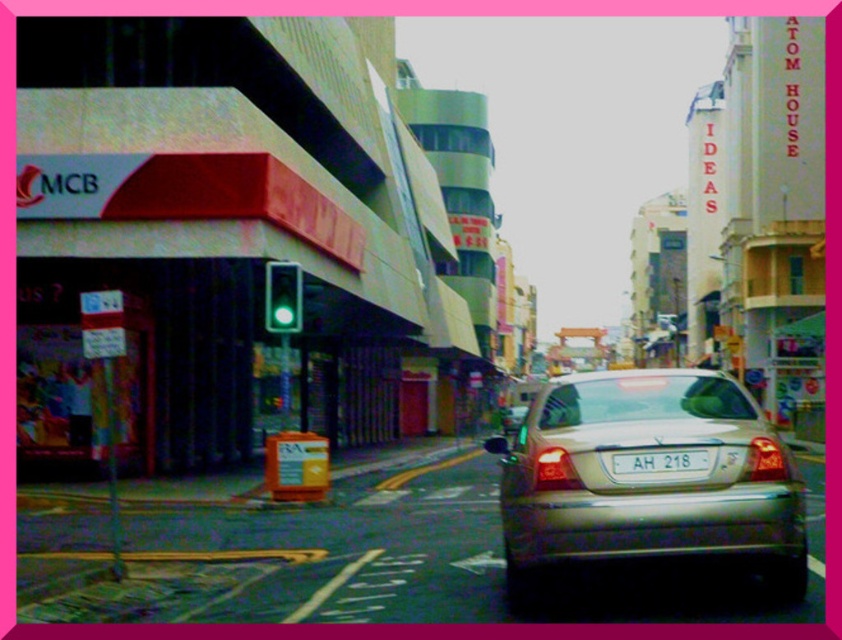
Can you confirm if silver metallic car at center is positioned above white plastic license plate at center?

No, silver metallic car at center is not above white plastic license plate at center.

Does silver metallic car at center come in front of white plastic license plate at center?

Yes.

Between point (734, 545) and point (656, 456), which one is positioned behind?

The point (734, 545) is behind.

The image size is (842, 640). What are the coordinates of `silver metallic car at center` in the screenshot? It's located at (647, 477).

Can you confirm if silver metallic car at center is positioned above green glass traffic light at center?

No, silver metallic car at center is not above green glass traffic light at center.

Can you confirm if silver metallic car at center is positioned to the right of green glass traffic light at center?

Yes, silver metallic car at center is to the right of green glass traffic light at center.

What do you see at coordinates (647, 477) in the screenshot? I see `silver metallic car at center` at bounding box center [647, 477].

Find the location of a particular element. This screenshot has width=842, height=640. silver metallic car at center is located at coordinates (647, 477).

Describe the element at coordinates (281, 298) in the screenshot. I see `green glass traffic light at center` at that location.

Is point (286, 308) in front of point (654, 465)?

No, it is not.

Where is `green glass traffic light at center`? This screenshot has width=842, height=640. green glass traffic light at center is located at coordinates (x=281, y=298).